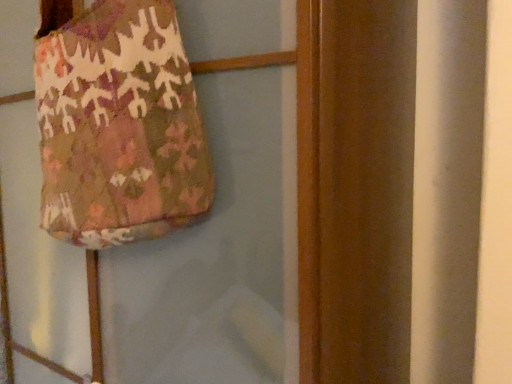
Question: From the image's perspective, is textured fabric bag at upper left above textured fabric bag at upper left?

Choices:
 (A) no
 (B) yes

Answer: (B)

Question: Can you confirm if textured fabric bag at upper left is positioned to the left of textured fabric bag at upper left?

Choices:
 (A) yes
 (B) no

Answer: (A)

Question: Can you confirm if textured fabric bag at upper left is taller than textured fabric bag at upper left?

Choices:
 (A) yes
 (B) no

Answer: (B)

Question: Is textured fabric bag at upper left thinner than textured fabric bag at upper left?

Choices:
 (A) no
 (B) yes

Answer: (B)

Question: Is textured fabric bag at upper left further to camera compared to textured fabric bag at upper left?

Choices:
 (A) yes
 (B) no

Answer: (A)

Question: Does textured fabric bag at upper left have a larger size compared to textured fabric bag at upper left?

Choices:
 (A) no
 (B) yes

Answer: (A)

Question: From a real-world perspective, is textured fabric bag at upper left positioned over textured fabric bag at upper left based on gravity?

Choices:
 (A) no
 (B) yes

Answer: (A)

Question: Is textured fabric bag at upper left bigger than textured fabric bag at upper left?

Choices:
 (A) yes
 (B) no

Answer: (A)

Question: Does textured fabric bag at upper left come behind textured fabric bag at upper left?

Choices:
 (A) no
 (B) yes

Answer: (A)

Question: Does textured fabric bag at upper left have a greater width compared to textured fabric bag at upper left?

Choices:
 (A) no
 (B) yes

Answer: (B)

Question: Would you say textured fabric bag at upper left is outside textured fabric bag at upper left?

Choices:
 (A) yes
 (B) no

Answer: (A)

Question: Is textured fabric bag at upper left closer to the viewer compared to textured fabric bag at upper left?

Choices:
 (A) no
 (B) yes

Answer: (B)

Question: From their relative heights in the image, would you say textured fabric bag at upper left is taller or shorter than textured fabric bag at upper left?

Choices:
 (A) tall
 (B) short

Answer: (A)